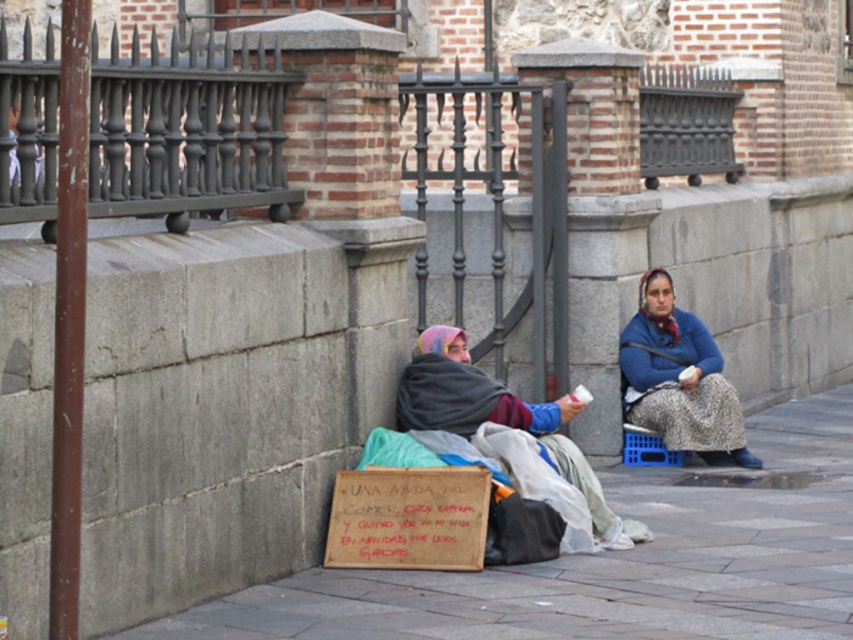
Question: Can you confirm if blue fabric headscarf at lower center is wider than multicolored fabric blanket at lower left?

Choices:
 (A) no
 (B) yes

Answer: (A)

Question: Considering the real-world distances, which object is closest to the gray concrete pavement at lower center?

Choices:
 (A) blue fabric headscarf at lower center
 (B) multicolored fabric blanket at lower left

Answer: (A)

Question: Is gray concrete pavement at lower center closer to the viewer compared to brown cardboard sign at lower center?

Choices:
 (A) no
 (B) yes

Answer: (B)

Question: Which of these objects is positioned farthest from the blue fabric headscarf at lower center?

Choices:
 (A) brown cardboard sign at lower center
 (B) gray concrete pavement at lower center
 (C) multicolored fabric blanket at lower left

Answer: (A)

Question: Where is brown cardboard sign at lower center located in relation to multicolored fabric blanket at lower left in the image?

Choices:
 (A) right
 (B) left

Answer: (B)

Question: Which is nearer to the gray concrete pavement at lower center?

Choices:
 (A) blue fabric headscarf at lower center
 (B) multicolored fabric blanket at lower left
 (C) brown cardboard sign at lower center

Answer: (C)